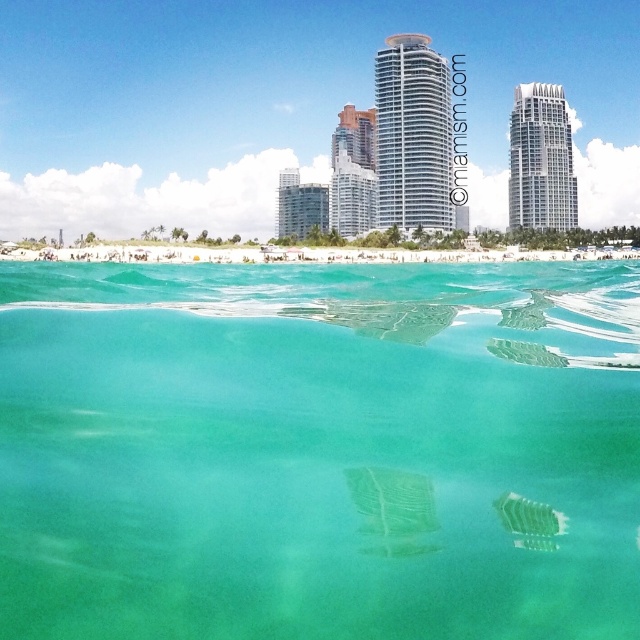
You are designing a postcard and want to highlight both the clear glass water at center and the white glassy building at upper right. Since the postcard has limited space, which object should you prioritize to ensure it fits better in the design?

The clear glass water at center is larger in size than the white glassy building at upper right, so you should prioritize including the clear glass water at center to ensure it fits better in the design.

You are a lifeguard on duty at the beach. You notice a swimmer struggling 50 meters away from the white glassy building at upper right. Can you reach them before they drift further away? The clear glass water at center is between you and the swimmer. Explain your reasoning.

The distance between the clear glass water at center and the white glassy building at upper right is 104.34 meters. Since the swimmer is 50 meters away from the building, they are 54.34 meters away from the clear glass water at center. As a lifeguard, you are positioned at the beach, so you would need to cover the 54.34 meters to reach the swimmer. With proper training and quick response, it is feasible to reach them before drifting further.

From the picture: You are a beachgoer who wants to build a sandcastle on the green sand at center. However, you notice the glassy teal skyscraper at center nearby. Is the skyscraper above or below the sand where you want to build?

The glassy teal skyscraper at center is located above the green sand at center, so it is above the sand where you want to build.